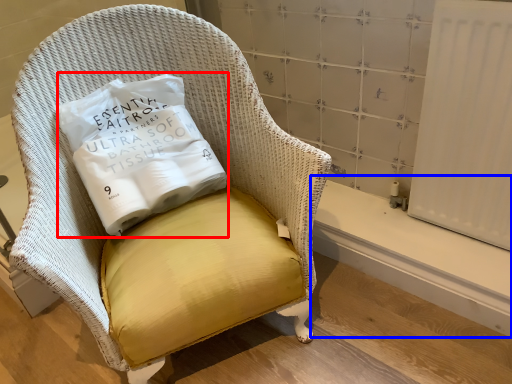
Question: Which point is closer to the camera, pillow (highlighted by a red box) or window sill (highlighted by a blue box)?

Choices:
 (A) pillow
 (B) window sill

Answer: (A)